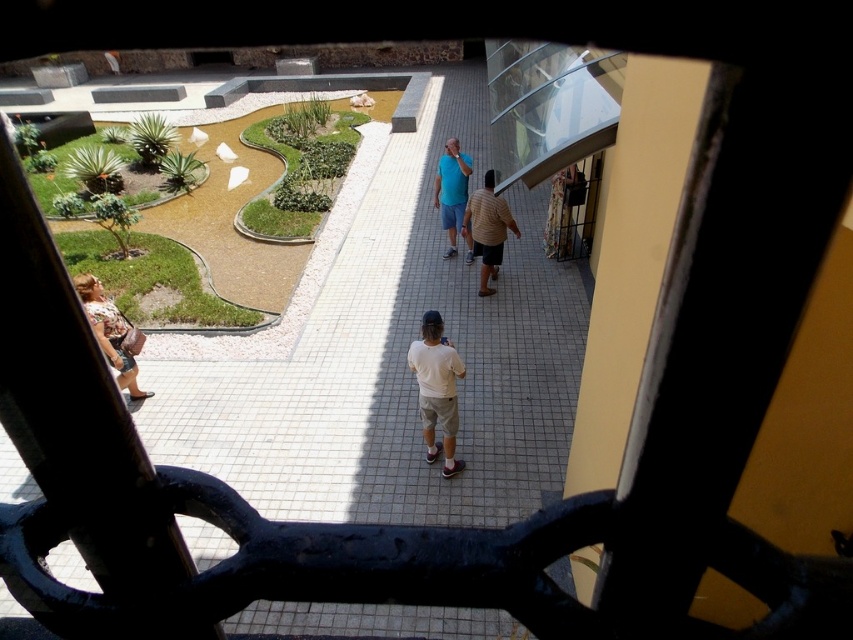
You are standing on the balcony looking down at the courtyard. You notice the white tile floor at center and the floral dress at lower left. Which object is higher from your viewpoint?

The white tile floor at center is higher than the floral dress at lower left from your viewpoint.